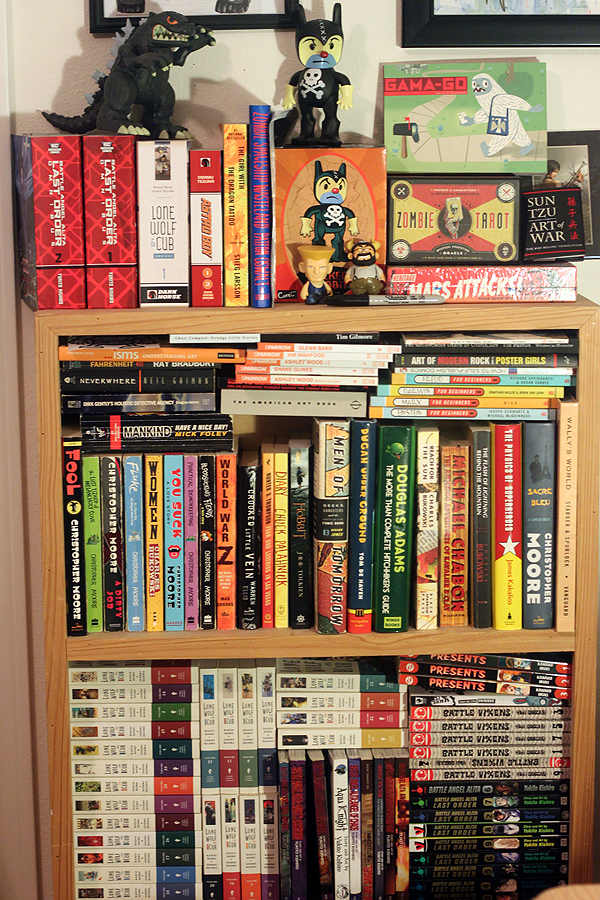
Where is `action figures`? The width and height of the screenshot is (600, 900). action figures is located at coordinates (313, 77), (149, 39), (319, 265), (370, 267).